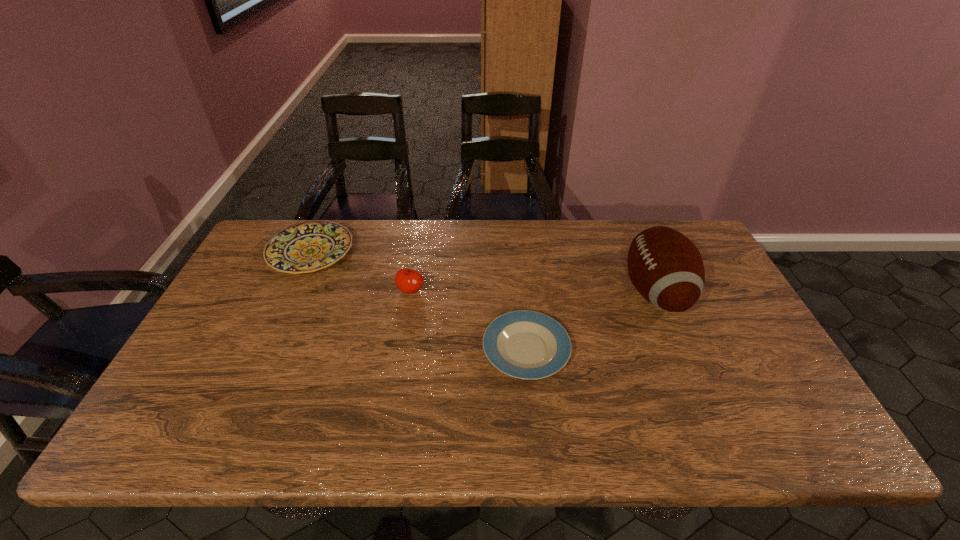
Image resolution: width=960 pixels, height=540 pixels. I want to click on vacant area located 0.150m on the laces of the rightmost object, so click(571, 292).

The image size is (960, 540). What are the coordinates of `vacant area situated 0.120m on the left of the second object from left to right` in the screenshot? It's located at (356, 290).

Identify the location of vacant space situated 0.340m on the right of the left plate. This screenshot has height=540, width=960. (458, 252).

Locate an element on the screen. The image size is (960, 540). vacant area located on the back of the right plate is located at coordinates (517, 262).

The height and width of the screenshot is (540, 960). Find the location of `football that is at the far edge`. football that is at the far edge is located at coordinates (666, 268).

The image size is (960, 540). What are the coordinates of `plate at the far edge` in the screenshot? It's located at (306, 247).

Where is `object situated at the left edge`? The width and height of the screenshot is (960, 540). object situated at the left edge is located at coordinates (306, 247).

Identify the location of object at the right edge. The width and height of the screenshot is (960, 540). (666, 268).

Where is `object at the far left corner`? The image size is (960, 540). object at the far left corner is located at coordinates (306, 247).

The height and width of the screenshot is (540, 960). What are the coordinates of `object that is at the far right corner` in the screenshot? It's located at (666, 268).